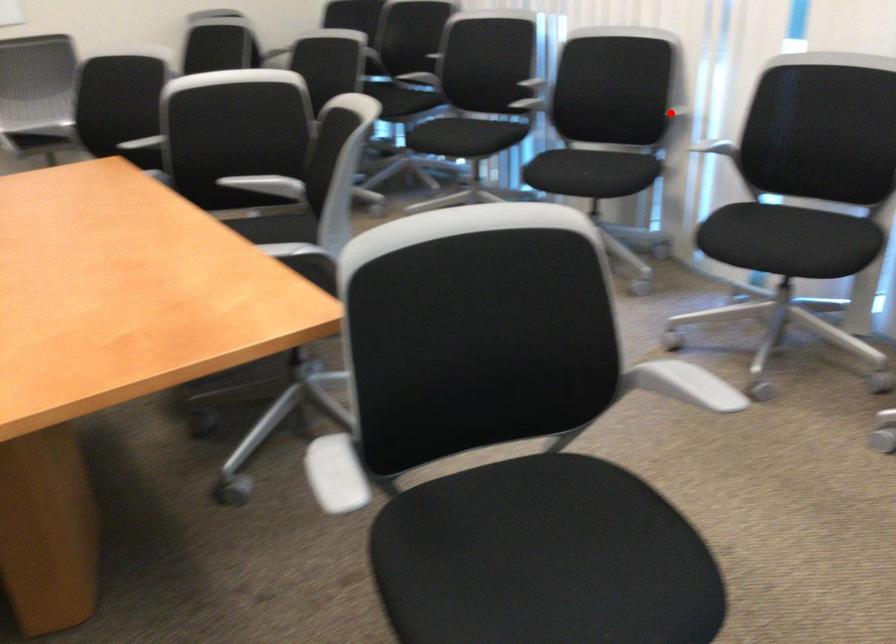
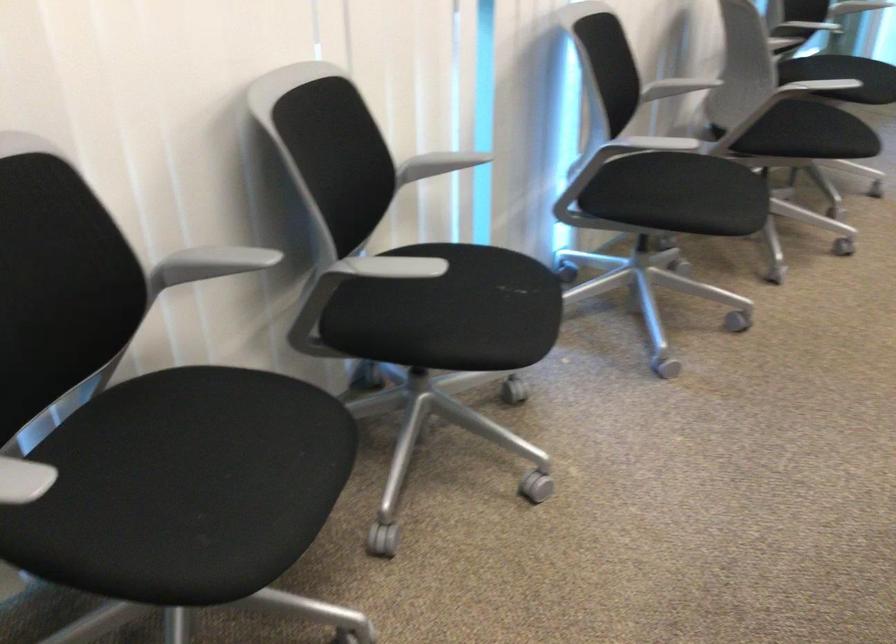
Question: A red point is marked in image1. In image2, is the corresponding 3D point closer to the camera or farther? Reply with the corresponding letter.

Choices:
 (A) The corresponding 3D point is closer.
 (B) The corresponding 3D point is farther.

Answer: (A)